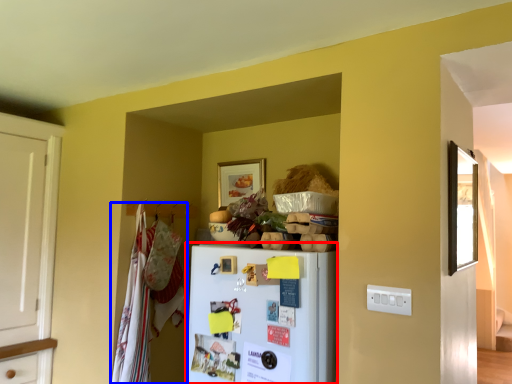
Question: Which object appears farthest to the camera in this image, refrigerator (highlighted by a red box) or laundry (highlighted by a blue box)?

Choices:
 (A) refrigerator
 (B) laundry

Answer: (B)